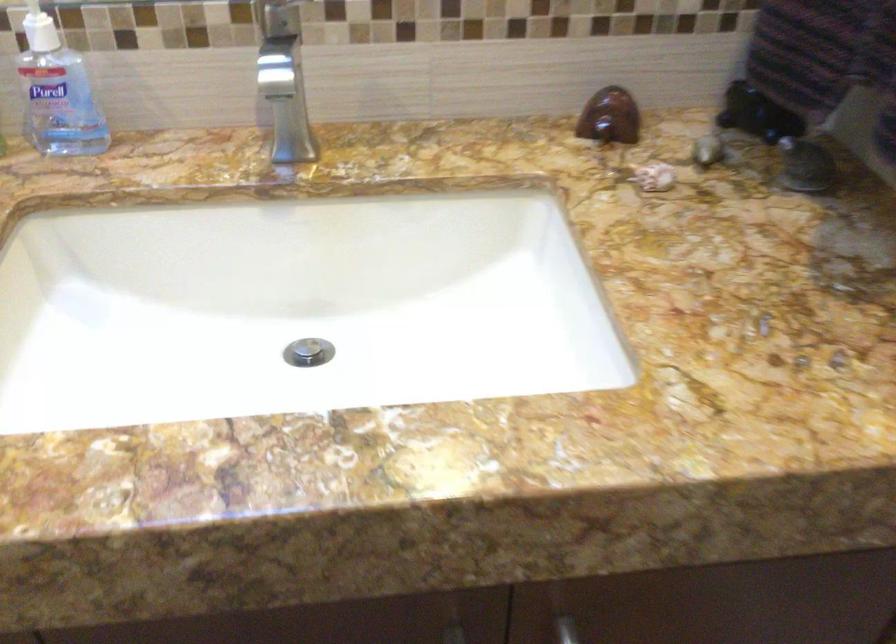
The height and width of the screenshot is (644, 896). What do you see at coordinates (268, 14) in the screenshot?
I see `the faucet handle` at bounding box center [268, 14].